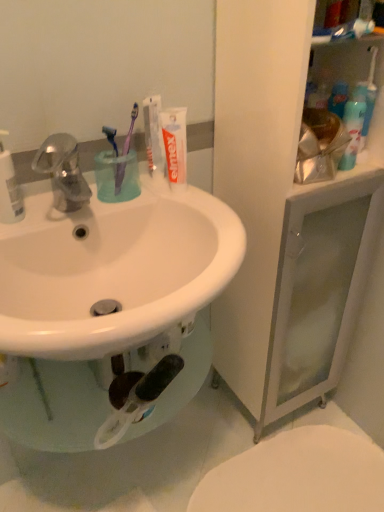
Question: Considering the positions of white matte toothpaste at upper center, the 2th toothpaste in the left-to-right sequence, and purple plastic toothbrush at upper center, which is the 2th toothbrush in left-to-right order, in the image, is white matte toothpaste at upper center, the 2th toothpaste in the left-to-right sequence, wider or thinner than purple plastic toothbrush at upper center, which is the 2th toothbrush in left-to-right order,?

Choices:
 (A) thin
 (B) wide

Answer: (A)

Question: Is white matte toothpaste at upper center, the 2th toothpaste in the left-to-right sequence, taller or shorter than purple plastic toothbrush at upper center, which is the 2th toothbrush in left-to-right order?

Choices:
 (A) short
 (B) tall

Answer: (A)

Question: Considering the real-world distances, which object is closest to the white matte toothpaste at upper center, which appears as the first toothpaste when viewed from the left?

Choices:
 (A) purple plastic toothbrush at upper center, the 1th toothbrush positioned from the right
 (B) translucent plastic spray bottle at upper right, which is the 1th cleaning product from right to left
 (C) purple plastic toothbrush at upper center, which ranks as the second toothbrush in right-to-left order
 (D) white plastic bottle at left, positioned as the second cleaning product in right-to-left order
 (E) white glossy toilet at lower right

Answer: (A)

Question: Which of these objects is positioned closest to the purple plastic toothbrush at upper center, placed as the first toothbrush when sorted from left to right?

Choices:
 (A) purple plastic toothbrush at upper center, which is the 2th toothbrush in left-to-right order
 (B) white matte toothpaste at upper center, which appears as the first toothpaste when viewed from the left
 (C) white matte toothpaste at upper center, the 2th toothpaste in the left-to-right sequence
 (D) white plastic bottle at left, the 2th cleaning product in the back-to-front sequence
 (E) matte silver faucet at upper left

Answer: (A)